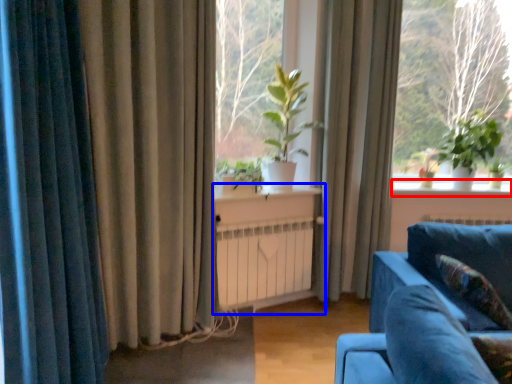
Question: Which point is closer to the camera, window sill (highlighted by a red box) or table (highlighted by a blue box)?

Choices:
 (A) window sill
 (B) table

Answer: (B)